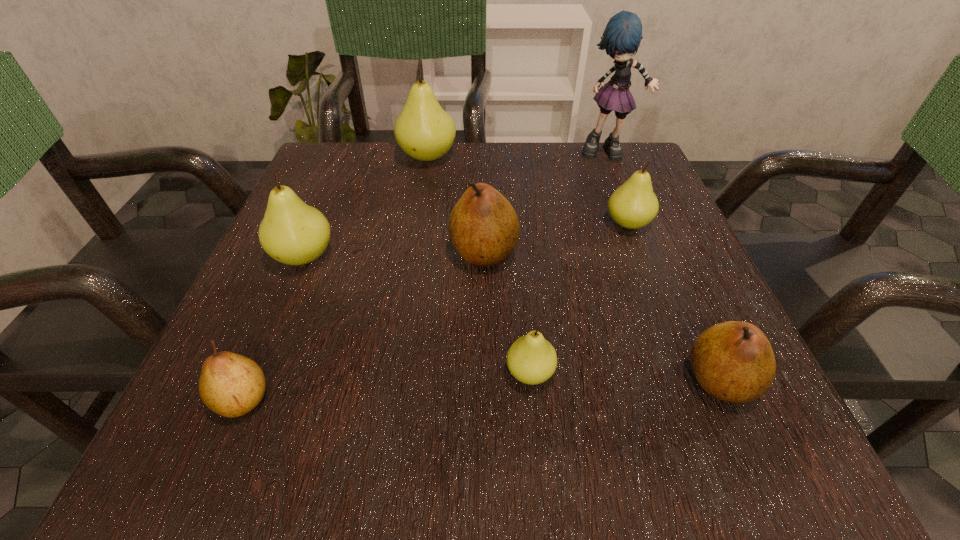
Identify the location of free space at the far left corner of the desktop. The image size is (960, 540). (340, 145).

This screenshot has height=540, width=960. Find the location of `vacant area at the near left corner`. vacant area at the near left corner is located at coordinates (165, 444).

At what (x,y) coordinates should I click in order to perform the action: click on free point at the far right corner. Please return your answer as a coordinate pair (x, y). This screenshot has height=540, width=960. Looking at the image, I should click on (645, 156).

Locate an element on the screen. vacant space at the near right corner of the desktop is located at coordinates (683, 423).

This screenshot has height=540, width=960. Identify the location of free space between the tallest pear and the second biggest green pear. (366, 207).

Where is `free spot between the second green pear from right to left and the second smallest green pear`? The image size is (960, 540). free spot between the second green pear from right to left and the second smallest green pear is located at coordinates (579, 299).

Image resolution: width=960 pixels, height=540 pixels. In order to click on free point between the tallest object and the leftmost brown pear in this screenshot , I will do `click(425, 276)`.

Locate an element on the screen. The image size is (960, 540). unoccupied position between the tallest object and the second smallest brown pear is located at coordinates 664,266.

Locate an element on the screen. This screenshot has width=960, height=540. empty space that is in between the rag doll and the leftmost brown pear is located at coordinates (425, 276).

At what (x,y) coordinates should I click in order to perform the action: click on empty location between the nearest green pear and the second smallest brown pear. Please return your answer as a coordinate pair (x, y). Looking at the image, I should click on (625, 377).